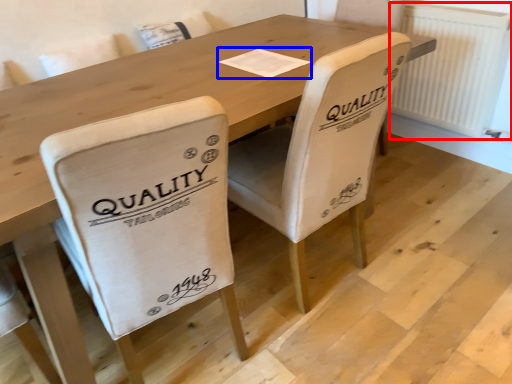
Question: Among these objects, which one is farthest to the camera, radiator (highlighted by a red box) or paper (highlighted by a blue box)?

Choices:
 (A) radiator
 (B) paper

Answer: (A)